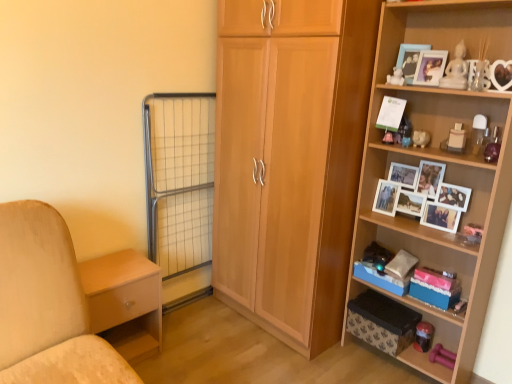
In order to click on vacant area that is in front of metal grid screen door at lower left in this screenshot , I will do `click(191, 332)`.